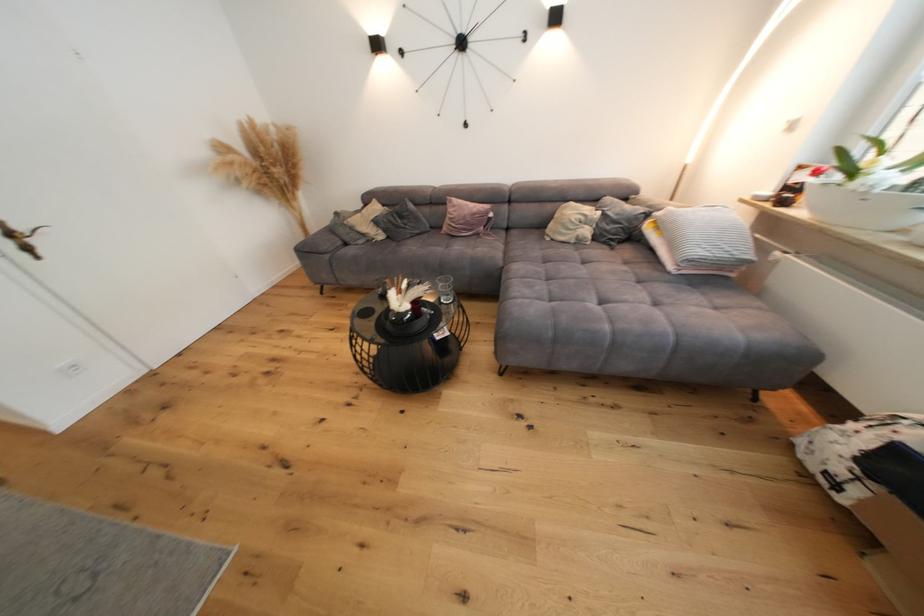
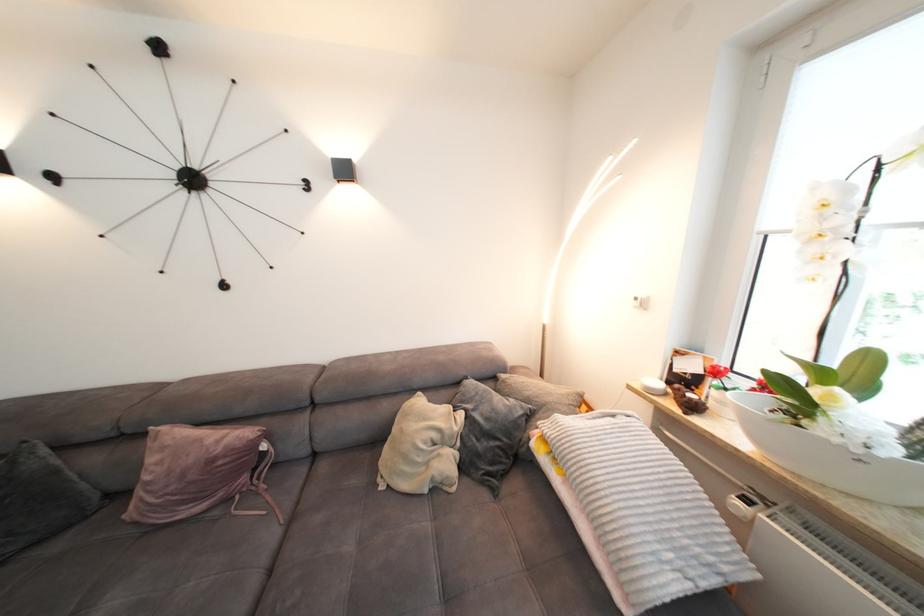
In the second image, find the point that corresponds to point 784,254 in the first image.

(746, 505)